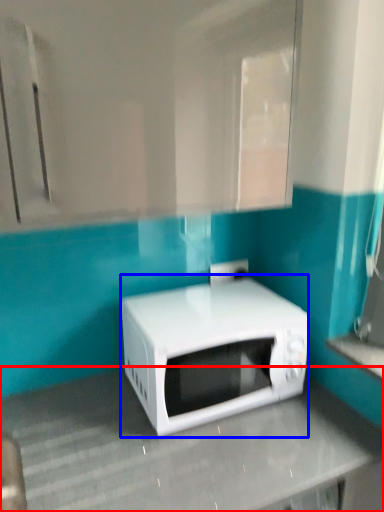
Question: Which of the following is the closest to the observer, counter top (highlighted by a red box) or microwave oven (highlighted by a blue box)?

Choices:
 (A) counter top
 (B) microwave oven

Answer: (A)